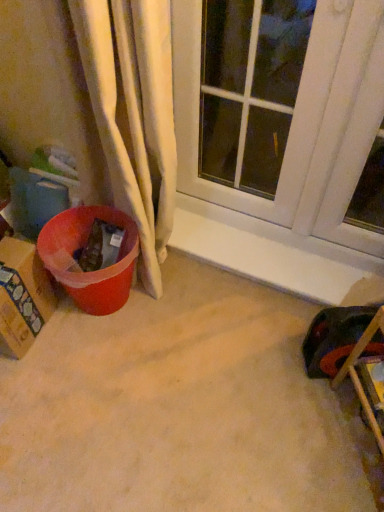
In order to face white glass window at upper center, should I rotate leftwards or rightwards?

Rotate right and turn 5.763 degrees.

Identify the location of white glass window at upper center. The width and height of the screenshot is (384, 512). (300, 122).

What do you see at coordinates (22, 296) in the screenshot?
I see `cardboard box at left` at bounding box center [22, 296].

Find the location of `white glass window at upper center`. white glass window at upper center is located at coordinates (300, 122).

Does white glass window at upper center come behind wooden chair at lower right?

Yes, white glass window at upper center is behind wooden chair at lower right.

From the image's perspective, which is above, white glass window at upper center or wooden chair at lower right?

white glass window at upper center appears higher in the image.

Could you tell me if white glass window at upper center is facing wooden chair at lower right?

No, white glass window at upper center does not turn towards wooden chair at lower right.

Is white smooth window sill at center wider or thinner than wooden chair at lower right?

In the image, white smooth window sill at center appears to be more narrow than wooden chair at lower right.

Visually, is white smooth window sill at center positioned to the left or to the right of wooden chair at lower right?

In the image, white smooth window sill at center appears on the left side of wooden chair at lower right.

Considering the relative sizes of white smooth window sill at center and wooden chair at lower right in the image provided, is white smooth window sill at center smaller than wooden chair at lower right?

Indeed, white smooth window sill at center has a smaller size compared to wooden chair at lower right.

Is the position of white smooth window sill at center more distant than that of wooden chair at lower right?

Yes, white smooth window sill at center is further from the camera.

From the image's perspective, which one is positioned lower, cardboard box at left or white glass window at upper center?

cardboard box at left appears lower in the image.

Is white glass window at upper center at the back of cardboard box at left?

No.

Can you confirm if cardboard box at left is smaller than white glass window at upper center?

Yes, cardboard box at left is smaller than white glass window at upper center.

Which point is more distant from viewer, (16, 242) or (349, 14)?

The point (16, 242) is behind.

Considering the points (20, 349) and (328, 278), which point is behind, point (20, 349) or point (328, 278)?

Positioned behind is point (328, 278).

In the scene shown: Does cardboard box at left appear on the left side of white smooth window sill at center?

Yes, cardboard box at left is to the left of white smooth window sill at center.

In the image, is cardboard box at left positioned in front of or behind white smooth window sill at center?

In the image, cardboard box at left appears in front of white smooth window sill at center.

How many degrees apart are the facing directions of cardboard box at left and white smooth window sill at center?

95.9 degrees separate the facing orientations of cardboard box at left and white smooth window sill at center.

Between wooden chair at lower right and white smooth window sill at center, which one appears on the left side from the viewer's perspective?

From the viewer's perspective, white smooth window sill at center appears more on the left side.

Which of these two, wooden chair at lower right or white smooth window sill at center, stands taller?

Standing taller between the two is wooden chair at lower right.

Is wooden chair at lower right oriented towards white smooth window sill at center?

No, wooden chair at lower right is not oriented towards white smooth window sill at center.

Which object is closer to the camera, wooden chair at lower right or white smooth window sill at center?

wooden chair at lower right.

Can we say wooden chair at lower right lies outside cardboard box at left?

Indeed, wooden chair at lower right is completely outside cardboard box at left.

In the scene shown: From the image's perspective, would you say wooden chair at lower right is positioned over cardboard box at left?

Incorrect, from the image's perspective, wooden chair at lower right is lower than cardboard box at left.

You are a GUI agent. You are given a task and a screenshot of the screen. Output one action in this format:
    pyautogui.click(x=<x>, y=<y>)
    Task: Click on the cardboard box behind the wooden chair at lower right
    
    Given the screenshot: What is the action you would take?
    pyautogui.click(x=22, y=296)

Considering the positions of objects wooden chair at lower right and cardboard box at left in the image provided, who is in front, wooden chair at lower right or cardboard box at left?

wooden chair at lower right is closer to the camera.

I want to click on furniture below the white glass window at upper center (from the image's perspective), so click(x=360, y=375).

Considering the positions of objects wooden chair at lower right and white glass window at upper center in the image provided, who is in front, wooden chair at lower right or white glass window at upper center?

wooden chair at lower right is in front.

Can you tell me how much wooden chair at lower right and white glass window at upper center differ in facing direction?

The facing directions of wooden chair at lower right and white glass window at upper center are 56.2 degrees apart.

Which of these two, wooden chair at lower right or white glass window at upper center, is bigger?

With larger size is white glass window at upper center.

This screenshot has width=384, height=512. What are the coordinates of `furniture on the right side of white glass window at upper center` in the screenshot? It's located at (360, 375).

Identify the location of furniture below the white smooth window sill at center (from the image's perspective). This screenshot has height=512, width=384. (360, 375).

From the image, which object appears to be nearer to wooden chair at lower right, white smooth window sill at center or cardboard box at left?

Based on the image, white smooth window sill at center appears to be nearer to wooden chair at lower right.

Estimate the real-world distances between objects in this image. Which object is further from cardboard box at left, white smooth window sill at center or white glass window at upper center?

white glass window at upper center is further to cardboard box at left.

From the picture: From the image, which object appears to be nearer to wooden chair at lower right, cardboard box at left or white glass window at upper center?

Based on the image, white glass window at upper center appears to be nearer to wooden chair at lower right.

Based on their spatial positions, is white glass window at upper center or white smooth window sill at center closer to wooden chair at lower right?

white smooth window sill at center lies closer to wooden chair at lower right than the other object.

Estimate the real-world distances between objects in this image. Which object is further from cardboard box at left, white smooth window sill at center or wooden chair at lower right?

wooden chair at lower right.

Considering their positions, is white glass window at upper center positioned closer to white smooth window sill at center than cardboard box at left?

white glass window at upper center lies closer to white smooth window sill at center than the other object.

Which object lies nearer to the anchor point cardboard box at left, white glass window at upper center or white smooth window sill at center?

The object closer to cardboard box at left is white smooth window sill at center.

Which object lies further to the anchor point white glass window at upper center, cardboard box at left or wooden chair at lower right?

cardboard box at left is further to white glass window at upper center.

This screenshot has width=384, height=512. Identify the location of window between cardboard box at left and wooden chair at lower right in the horizontal direction. (300, 122).

Locate an element on the screen. window sill between white glass window at upper center and wooden chair at lower right from top to bottom is located at coordinates (276, 254).

The image size is (384, 512). Identify the location of window between cardboard box at left and white smooth window sill at center in the horizontal direction. point(300,122).

Locate an element on the screen. window sill between cardboard box at left and wooden chair at lower right from left to right is located at coordinates (276, 254).